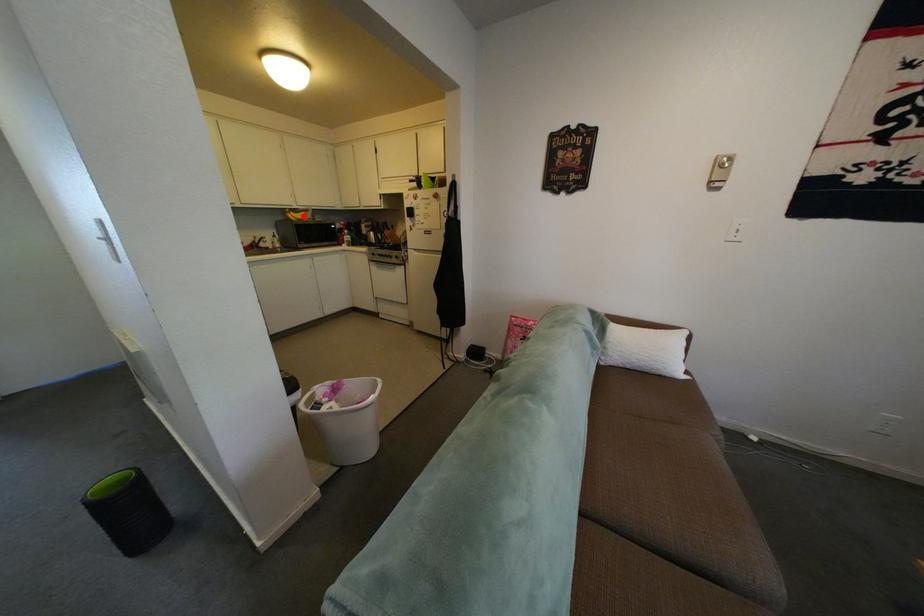
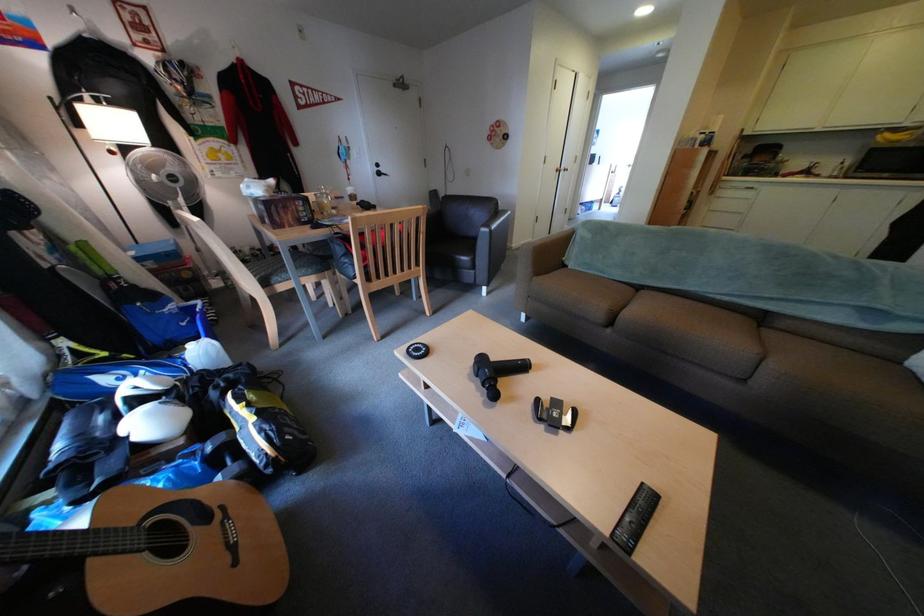
Question: I am providing you with two images of the same scene from different viewpoints. A red point is marked on the first image. Is the red point's position out of view in image 2?

Choices:
 (A) Yes
 (B) No

Answer: (B)